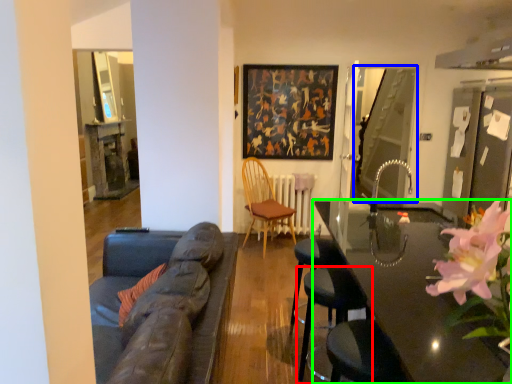
Question: Which object is the closest to the chair (highlighted by a red box)? Choose among these: glass door (highlighted by a blue box) or table (highlighted by a green box).

Choices:
 (A) glass door
 (B) table

Answer: (B)